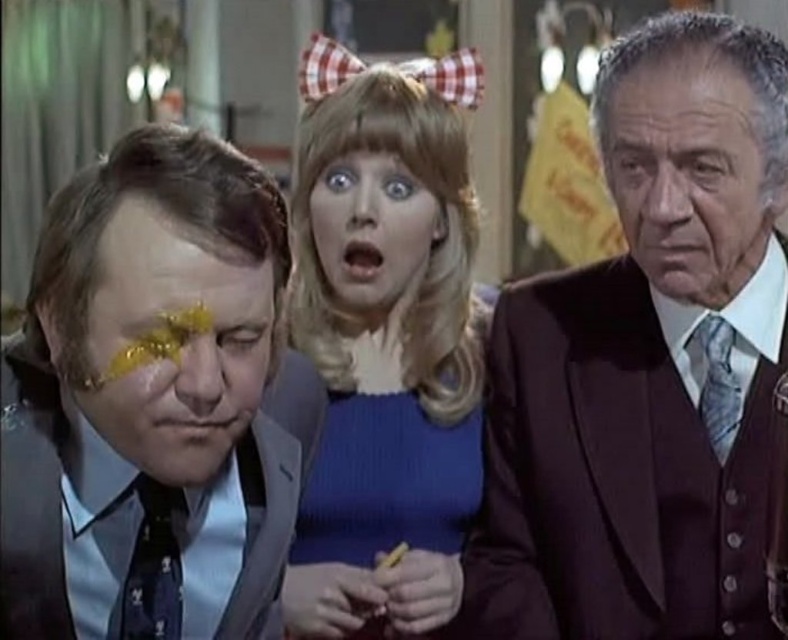
You are standing in a room with two people. You see a maroon wool suit at right and a dark blue textured tie at left. Which one is positioned to the right side?

The maroon wool suit at right is positioned to the right side of the dark blue textured tie at left.

You are standing at the point labeled point (719, 22) and want to reach the door located at the opposite side of the room. If you can walk 6 feet in one minute, how long will it take you to reach the door?

The distance between you and the door is 5.71 feet. Since you can walk 6 feet in one minute, it will take you approximately 57 seconds to reach the door.